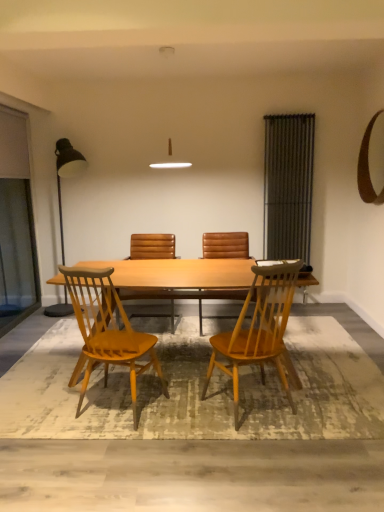
Find the location of a particular element. The image size is (384, 512). free space to the right of matte wood chair at center, the 3th chair in the back-to-front sequence is located at coordinates (x=187, y=409).